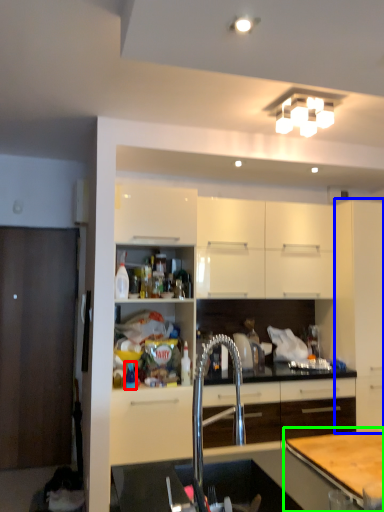
Question: Estimate the real-world distances between objects in this image. Which object is closer to bottle (highlighted by a red box), cabinetry (highlighted by a blue box) or table (highlighted by a green box)?

Choices:
 (A) cabinetry
 (B) table

Answer: (B)